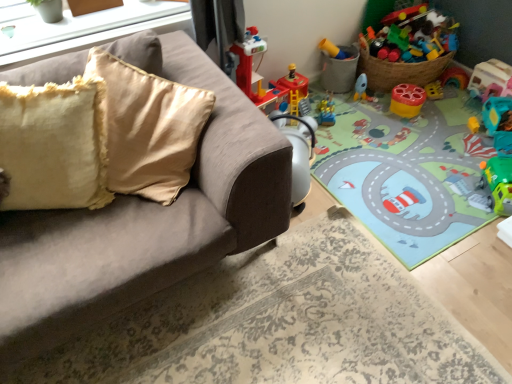
You are a GUI agent. You are given a task and a screenshot of the screen. Output one action in this format:
    pyautogui.click(x=<x>, y=<y>)
    Task: Click on the free space that is to the left of green plastic toy car at lower right, which is the 4th toy in left-to-right order
    
    Given the screenshot: What is the action you would take?
    pyautogui.click(x=460, y=196)